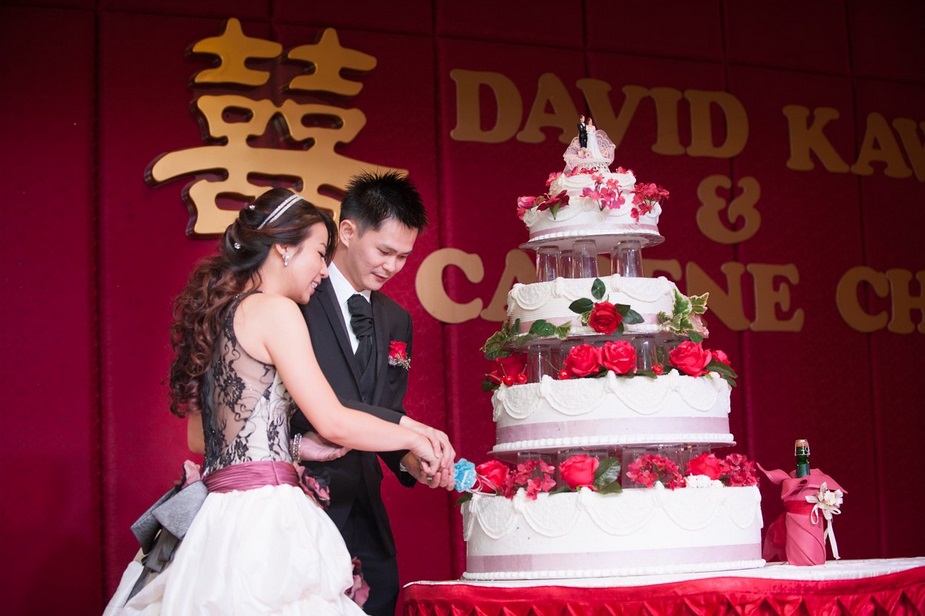
The image size is (925, 616). I want to click on table, so click(780, 573).